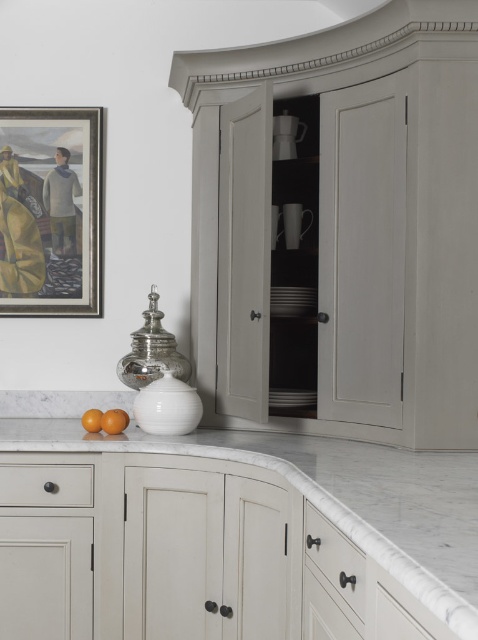
Is point (336, 580) behind point (120, 420)?

No, it is not.

Is point (361, 596) in front of point (121, 428)?

Yes.

You are a GUI agent. You are given a task and a screenshot of the screen. Output one action in this format:
    pyautogui.click(x=<x>, y=<y>)
    Task: Click on the matte white drawer at lower center
    The height and width of the screenshot is (640, 478).
    Given the screenshot: What is the action you would take?
    pyautogui.click(x=336, y=561)

Can you confirm if wooden frame at upper left is smaller than matte white drawer at lower left?

Actually, wooden frame at upper left might be larger than matte white drawer at lower left.

Who is positioned more to the right, wooden frame at upper left or matte white drawer at lower left?

From the viewer's perspective, matte white drawer at lower left appears more on the right side.

Between point (41, 189) and point (69, 486), which one is positioned behind?

Point (41, 189)

Where is `wooden frame at upper left`? The image size is (478, 640). wooden frame at upper left is located at coordinates (50, 211).

Is white marble countertop at center shorter than orangesmoothfruit at lower left?

Yes.

Does white marble countertop at center have a greater height compared to orangesmoothfruit at lower left?

Incorrect, white marble countertop at center's height is not larger of orangesmoothfruit at lower left's.

Where is `white marble countertop at center`? The image size is (478, 640). white marble countertop at center is located at coordinates (338, 497).

The image size is (478, 640). I want to click on white marble countertop at center, so click(x=338, y=497).